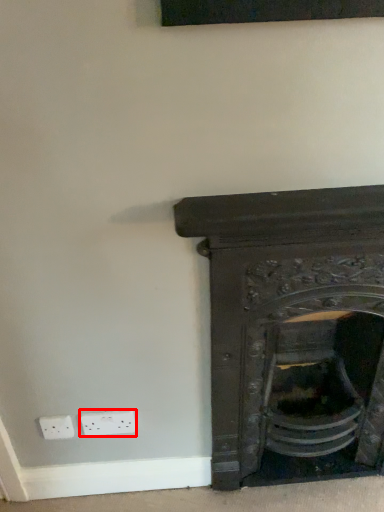
Question: From the image's perspective, what is the correct spatial positioning of electric outlet (annotated by the red box) in reference to fireplace?

Choices:
 (A) above
 (B) below

Answer: (B)